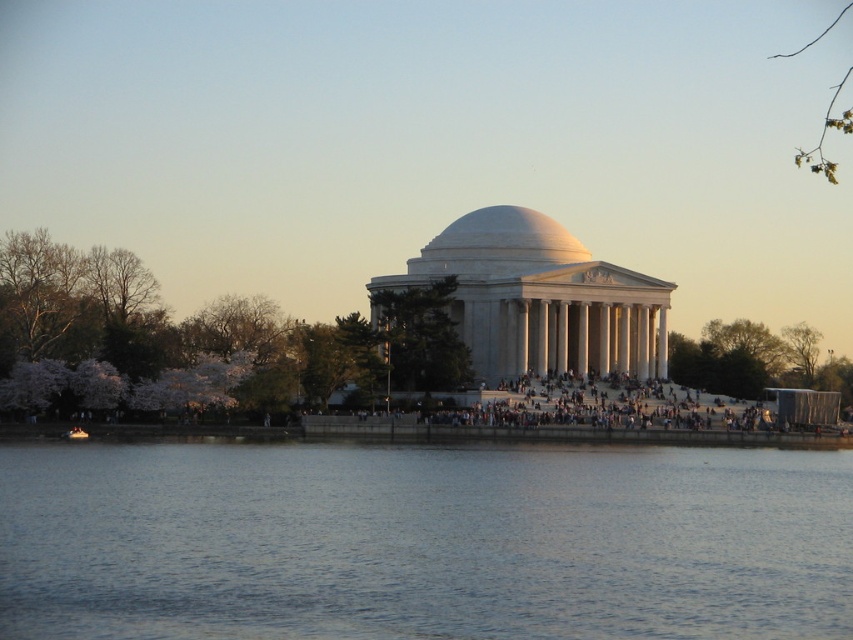
Question: Which point is farther to the camera?

Choices:
 (A) smooth stone steps at center
 (B) green leafy branch at upper right

Answer: (B)

Question: Which of the following is the closest to the observer?

Choices:
 (A) (788, 333)
 (B) (82, 300)
 (C) (368, 460)

Answer: (C)

Question: Does pink blossoms at left come behind green leafy tree at center?

Choices:
 (A) yes
 (B) no

Answer: (B)

Question: Which object is the closest to the smooth stone steps at center?

Choices:
 (A) green leafy tree at lower right
 (B) green leafy tree at center
 (C) green leafy branch at upper right
 (D) blue water at center

Answer: (B)

Question: Is blue water at center smaller than green leafy tree at lower right?

Choices:
 (A) no
 (B) yes

Answer: (A)

Question: Is green leafy tree at lower right smaller than smooth stone steps at center?

Choices:
 (A) no
 (B) yes

Answer: (A)